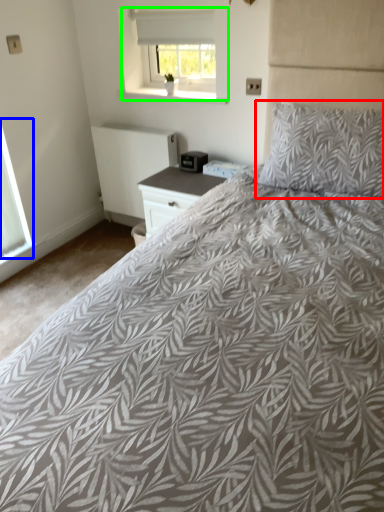
Question: Which object is positioned farthest from pillow (highlighted by a red box)? Select from window (highlighted by a blue box) and window (highlighted by a green box).

Choices:
 (A) window
 (B) window

Answer: (A)